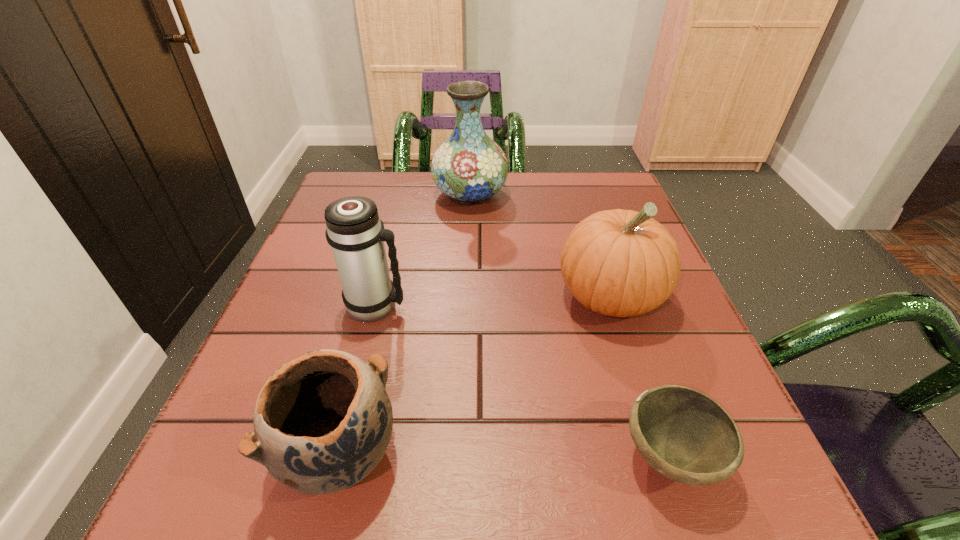
Find the location of a particular element. This screenshot has width=960, height=540. free region that satisfies the following two spatial constraints: 1. on the stem of the pumpkin; 2. on the side with the handle of the thermos bottle is located at coordinates (612, 305).